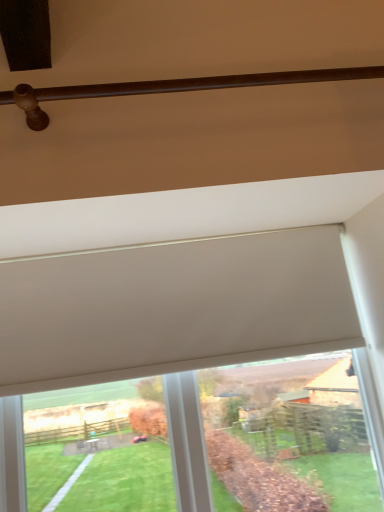
You are a GUI agent. You are given a task and a screenshot of the screen. Output one action in this format:
    pyautogui.click(x=<x>, y=<y>)
    Task: Click on the white matte roller blind at center
    
    Given the screenshot: What is the action you would take?
    coord(174,309)

Measure the distance between white matte roller blind at center and camera.

They are 4.09 feet apart.

In order to face white matte roller blind at center, should I rotate leftwards or rightwards?

It's best to rotate left around 0.486 degrees.

Image resolution: width=384 pixels, height=512 pixels. What do you see at coordinates (174, 309) in the screenshot?
I see `white matte roller blind at center` at bounding box center [174, 309].

This screenshot has height=512, width=384. I want to click on white matte roller blind at center, so click(174, 309).